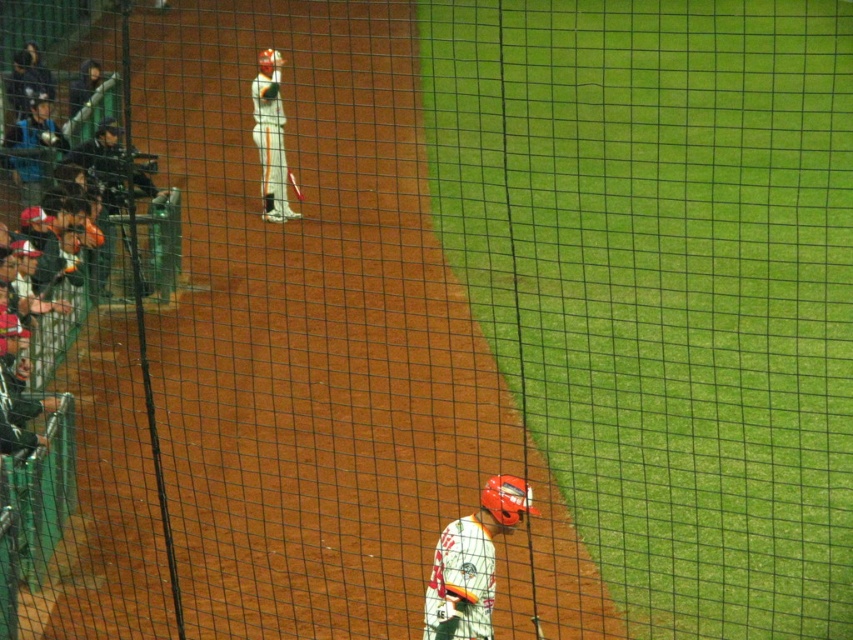
Can you confirm if white jersey at lower center is wider than white matte uniform at center?

Incorrect, white jersey at lower center's width does not surpass white matte uniform at center's.

What do you see at coordinates (473, 563) in the screenshot? I see `white jersey at lower center` at bounding box center [473, 563].

Identify the location of white jersey at lower center. (473, 563).

Can you confirm if white jersey at lower center is taller than matte black helmet at left?

In fact, white jersey at lower center may be shorter than matte black helmet at left.

Is the position of white jersey at lower center more distant than that of matte black helmet at left?

No.

You are a GUI agent. You are given a task and a screenshot of the screen. Output one action in this format:
    pyautogui.click(x=<x>, y=<y>)
    Task: Click on the white jersey at lower center
    
    Given the screenshot: What is the action you would take?
    pyautogui.click(x=473, y=563)

Between white matte uniform at center and matte black helmet at left, which one appears on the left side from the viewer's perspective?

matte black helmet at left is more to the left.

Which is in front, point (270, 218) or point (26, 189)?

Positioned in front is point (26, 189).

At what (x,y) coordinates should I click in order to perform the action: click on white matte uniform at center. Please return your answer as a coordinate pair (x, y). This screenshot has height=640, width=853. Looking at the image, I should click on (270, 136).